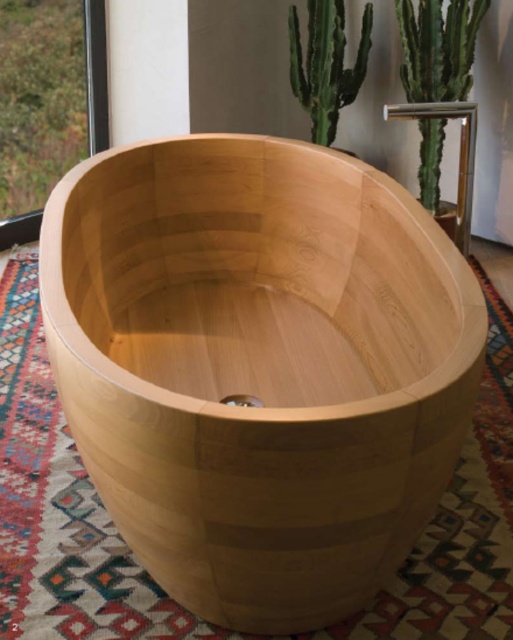
Is point (314, 225) positioned after point (460, 58)?

No, (314, 225) is in front of (460, 58).

Is point (407, 419) less distant than point (440, 163)?

Yes, point (407, 419) is in front of point (440, 163).

Describe the element at coordinates (259, 368) in the screenshot. Image resolution: width=513 pixels, height=640 pixels. I see `natural wood bathtub at center` at that location.

Find the location of a particular element. Image resolution: width=513 pixels, height=640 pixels. natural wood bathtub at center is located at coordinates (259, 368).

Does natural wood bathtub at center appear on the right side of green textured cactus at upper right?

In fact, natural wood bathtub at center is to the left of green textured cactus at upper right.

Where is `natural wood bathtub at center`? The image size is (513, 640). natural wood bathtub at center is located at coordinates tap(259, 368).

In order to click on natural wood bathtub at center in this screenshot , I will do `click(259, 368)`.

Based on the photo, does green smooth cactus at upper right have a lesser height compared to green textured cactus at upper right?

No.

Does green smooth cactus at upper right come in front of green textured cactus at upper right?

Yes, it is in front of green textured cactus at upper right.

This screenshot has height=640, width=513. I want to click on green smooth cactus at upper right, so click(x=438, y=48).